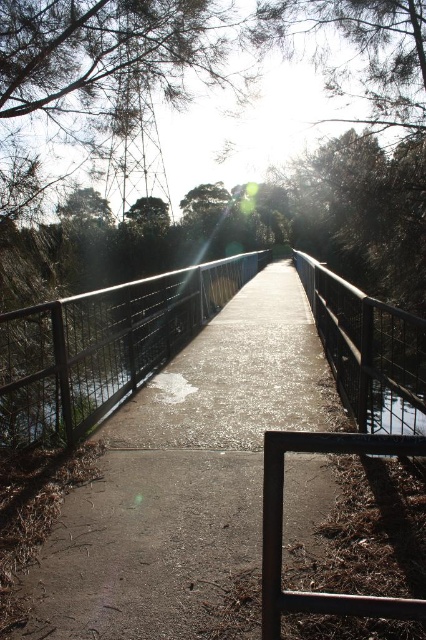
Question: Considering the relative positions of concrete path at center and rusty metal balustrade at lower right in the image provided, where is concrete path at center located with respect to rusty metal balustrade at lower right?

Choices:
 (A) left
 (B) right

Answer: (A)

Question: Which object appears closest to the camera in this image?

Choices:
 (A) rusty metal balustrade at lower right
 (B) concrete path at center

Answer: (A)

Question: Does concrete path at center lie in front of rusty metal balustrade at lower right?

Choices:
 (A) no
 (B) yes

Answer: (A)

Question: Which object appears farthest from the camera in this image?

Choices:
 (A) concrete path at center
 (B) rusty metal balustrade at lower right

Answer: (A)

Question: Which point is closer to the camera?

Choices:
 (A) concrete path at center
 (B) rusty metal balustrade at lower right

Answer: (B)

Question: Is concrete path at center to the right of rusty metal balustrade at lower right from the viewer's perspective?

Choices:
 (A) no
 (B) yes

Answer: (A)